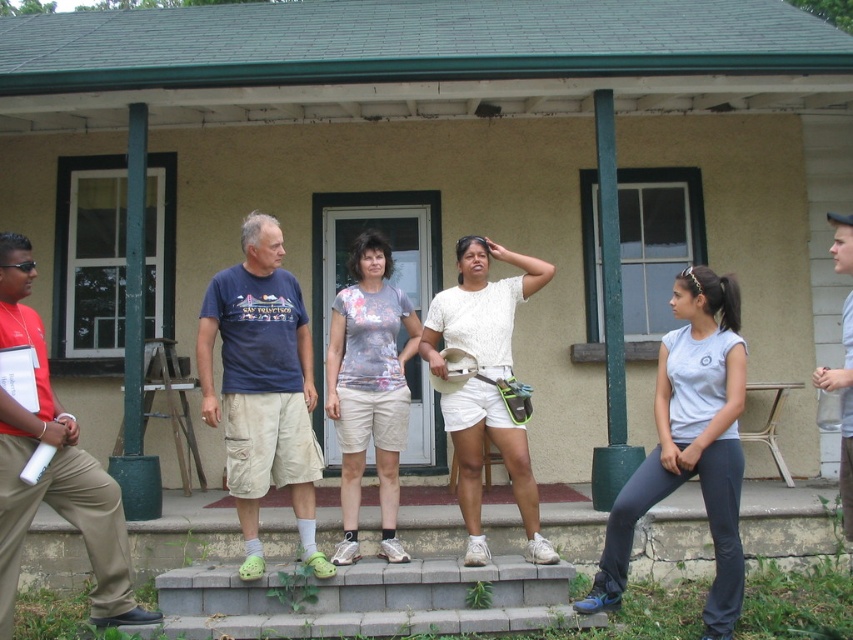
Image resolution: width=853 pixels, height=640 pixels. What do you see at coordinates (370, 600) in the screenshot? I see `gray concrete stairs at lower center` at bounding box center [370, 600].

Who is lower down, gray concrete stairs at lower center or white cotton shirt at center?

gray concrete stairs at lower center is below.

What do you see at coordinates (370, 600) in the screenshot? I see `gray concrete stairs at lower center` at bounding box center [370, 600].

At what (x,y) coordinates should I click in order to perform the action: click on gray concrete stairs at lower center. Please return your answer as a coordinate pair (x, y). Looking at the image, I should click on (370, 600).

Which of these two, gray concrete stairs at lower center or light blue shirt at center, stands shorter?

gray concrete stairs at lower center is shorter.

How far apart are gray concrete stairs at lower center and light blue shirt at center?

They are 8.28 feet apart.

What do you see at coordinates (370, 600) in the screenshot? I see `gray concrete stairs at lower center` at bounding box center [370, 600].

I want to click on gray concrete stairs at lower center, so click(370, 600).

Does point (445, 602) come farther from viewer compared to point (358, 371)?

That is False.

Does point (514, 576) come behind point (384, 502)?

No, it is not.

The image size is (853, 640). Identify the location of gray concrete stairs at lower center. (370, 600).